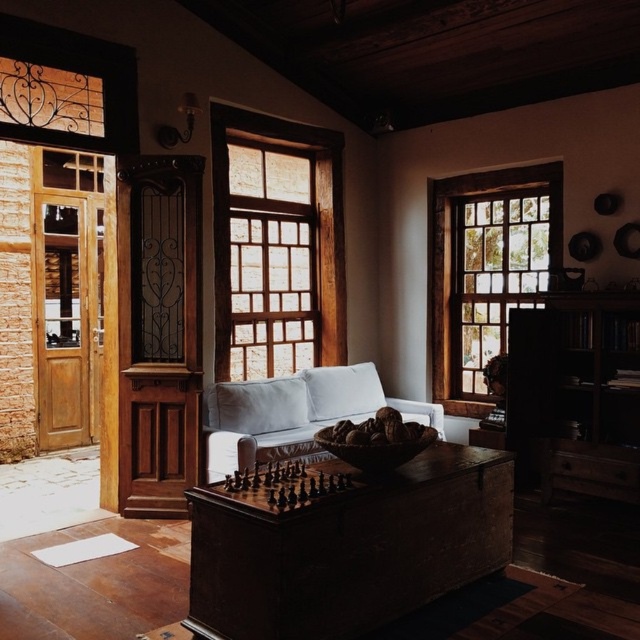
Question: Is wooden bookshelf at right positioned behind light gray fabric couch at center?

Choices:
 (A) yes
 (B) no

Answer: (B)

Question: From the image, what is the correct spatial relationship of wooden frame at right in relation to wooden frame at center?

Choices:
 (A) right
 (B) left

Answer: (A)

Question: Which point appears closest to the camera in this image?

Choices:
 (A) (218, 595)
 (B) (627, 404)

Answer: (A)

Question: Can you confirm if wooden frame at right is positioned above light gray fabric couch at center?

Choices:
 (A) yes
 (B) no

Answer: (A)

Question: Which point is farther from the camera taking this photo?

Choices:
 (A) tap(225, 448)
 (B) tap(481, 342)

Answer: (B)

Question: Which of the following is the closest to the observer?

Choices:
 (A) (355, 387)
 (B) (563, 387)

Answer: (B)